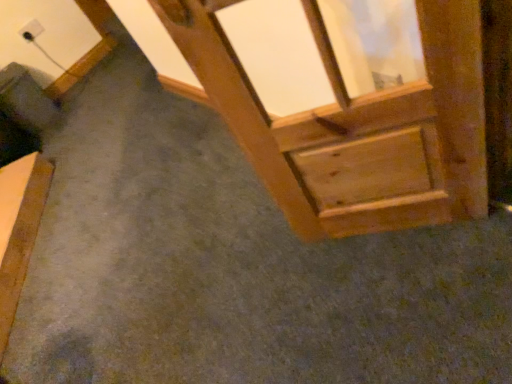
I want to click on free space in front of wooden frame at upper right, so click(430, 281).